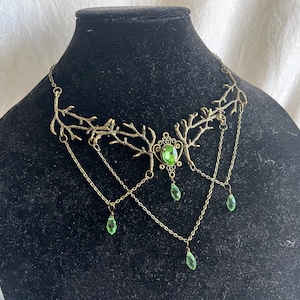
Locate an element on the screen. The height and width of the screenshot is (300, 300). black thing you put stuff on is located at coordinates (116, 70).